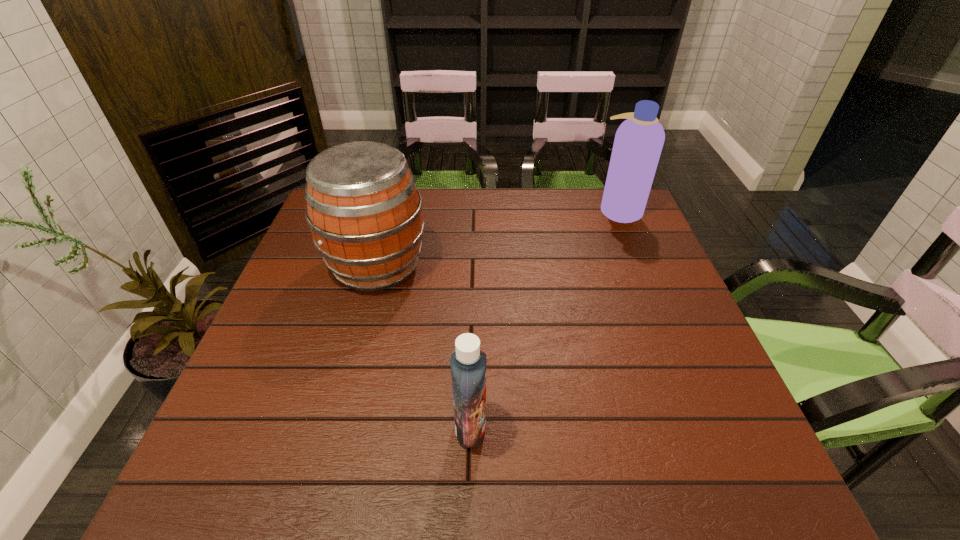
Locate which object is the closest to the farthest object. Please provide its 2D coordinates. Your answer should be formatted as a tuple, i.e. [(x, y)], where the tuple contains the x and y coordinates of a point satisfying the conditions above.

[(364, 211)]